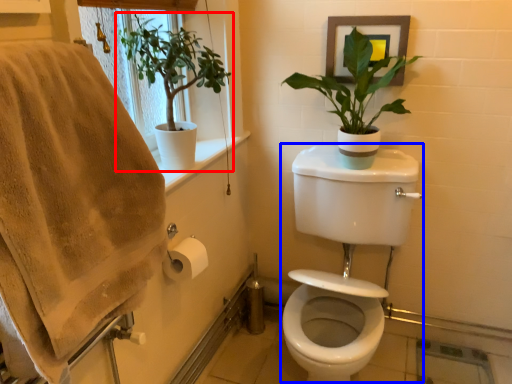
Question: Which object is further to the camera taking this photo, houseplant (highlighted by a red box) or sink (highlighted by a blue box)?

Choices:
 (A) houseplant
 (B) sink

Answer: (A)